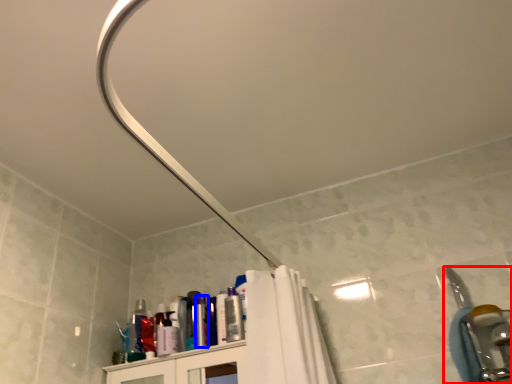
Question: Which object appears closest to the camera in this image, plumbing fixture (highlighted by a red box) or toiletry (highlighted by a blue box)?

Choices:
 (A) plumbing fixture
 (B) toiletry

Answer: (A)